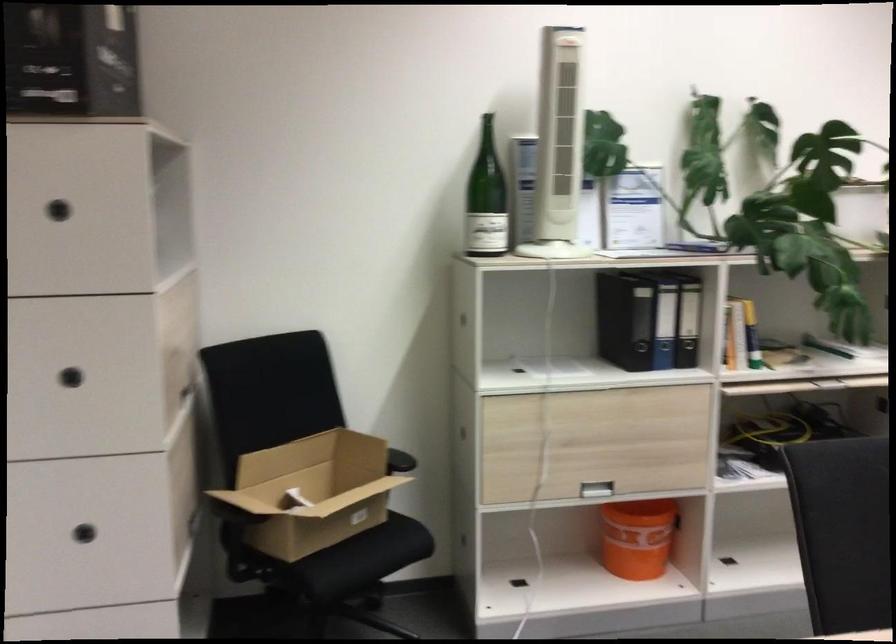
Describe the element at coordinates (738, 573) in the screenshot. I see `a recessed drawer handle` at that location.